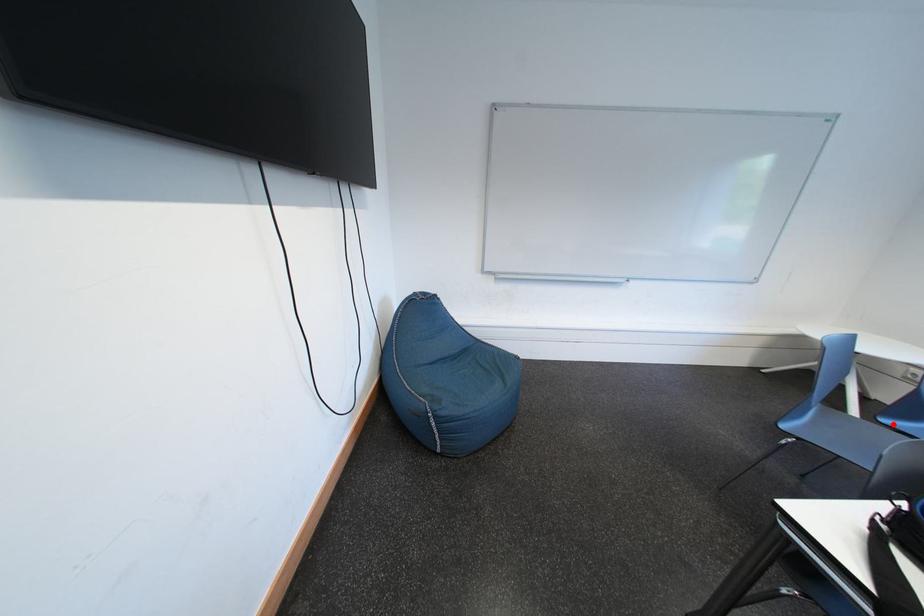
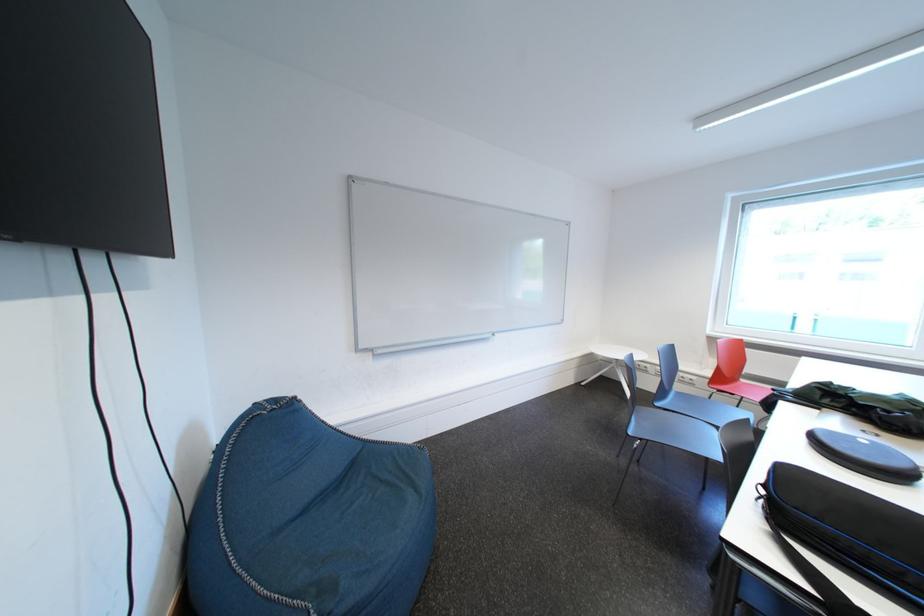
Where in the second image is the point corresponding to the highlighted location from the first image?

(666, 408)